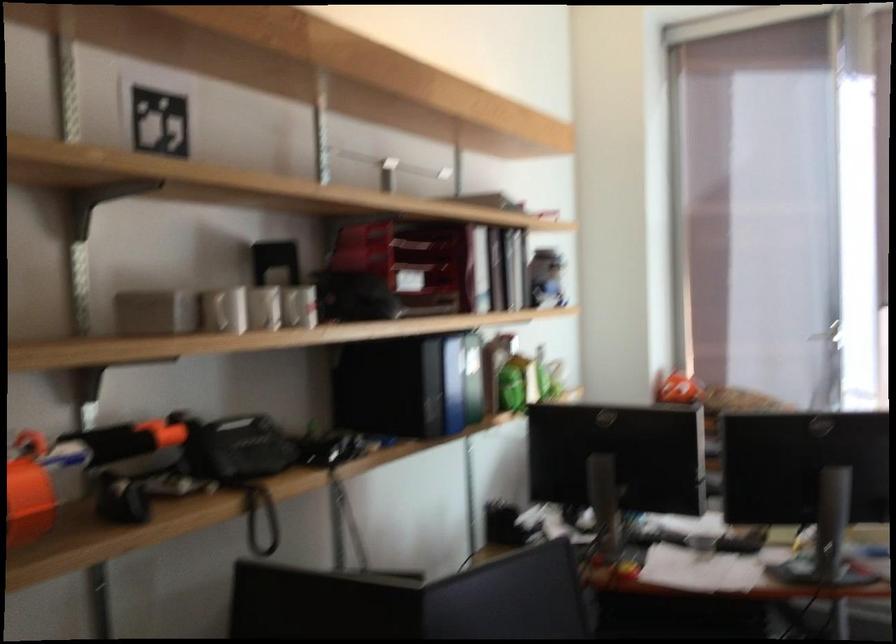
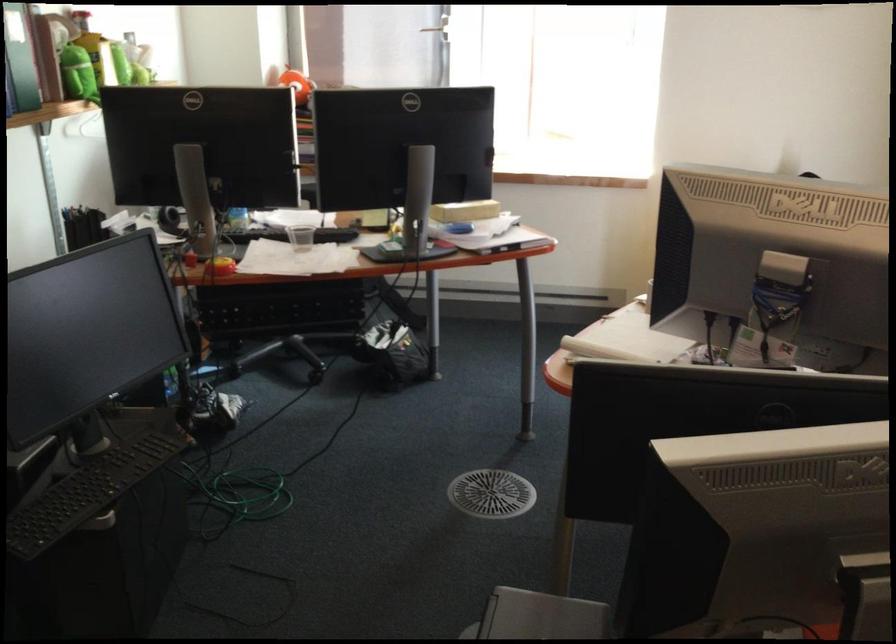
Where in the second image is the point corresponding to pixel 526 366 from the first image?

(95, 49)